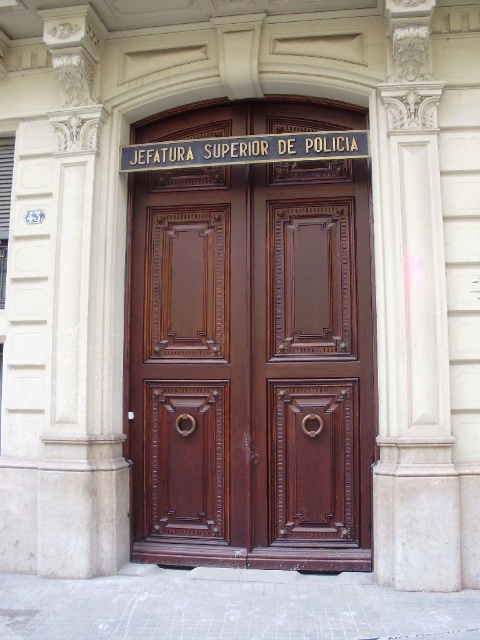
Question: Can you confirm if brown polished wood door at center is wider than gold metallic sign at center?

Choices:
 (A) yes
 (B) no

Answer: (A)

Question: Can you confirm if brown polished wood door at center is positioned to the left of white marble pillar at upper right?

Choices:
 (A) yes
 (B) no

Answer: (A)

Question: Is white marble pillar at upper right below gold metallic sign at center?

Choices:
 (A) no
 (B) yes

Answer: (B)

Question: Which of these objects is positioned farthest from the brown polished wood door at center?

Choices:
 (A) gold metallic sign at center
 (B) white marble pillar at upper right

Answer: (A)

Question: Which point appears closest to the camera in this image?

Choices:
 (A) (412, 378)
 (B) (264, 388)

Answer: (A)

Question: Which point is closer to the camera?

Choices:
 (A) gold metallic sign at center
 (B) white marble pillar at upper right
 (C) brown polished wood door at center

Answer: (B)